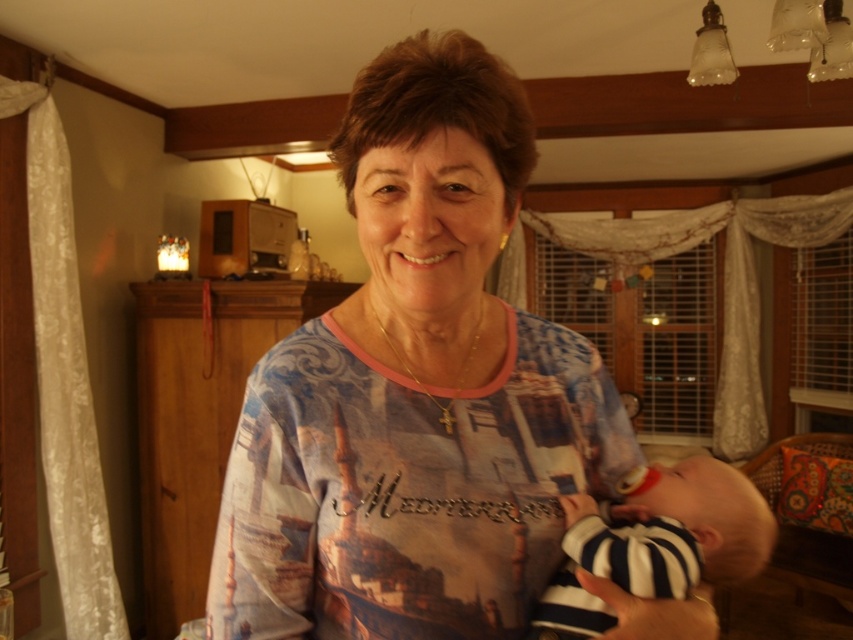
You are a photographer trying to capture the woman and baby in the scene. The blue printed shirt at center is represented by point (415,392). If you want to focus on the blue printed shirt at center, where should you aim your camera? Please provide coordinates in the format of x,y between 0 and 1.

The blue printed shirt at center is represented by point (415,392), so you should aim your camera at coordinates (415,392) to focus on it.

You are a photographer trying to capture a closeup of the blue printed shirt at center and the striped cotton onesie at center. Since the camera can only focus on one object at a time, which object should you choose to ensure the larger one is in focus?

The blue printed shirt at center has a larger size compared to striped cotton onesie at center, so you should focus on the blue printed shirt at center to ensure the larger one is in focus.

You are a photographer trying to capture the baby in the striped cotton onesie at center without the blue printed shirt at center blocking the view. Can you adjust your angle to do this?

The blue printed shirt at center is located above the striped cotton onesie at center, so adjusting your angle downward might allow you to capture the baby without the shirt blocking the view.